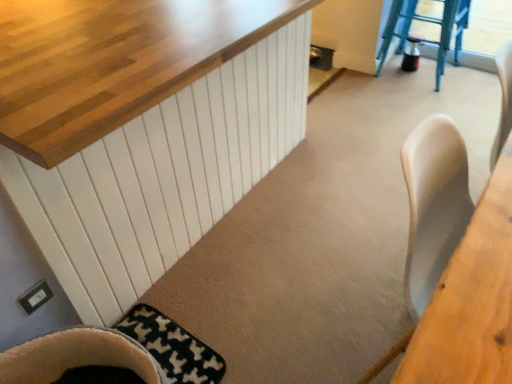
Question: Does wooden table at right have a smaller size compared to soft beige fabric chair at lower left?

Choices:
 (A) no
 (B) yes

Answer: (A)

Question: From the image's perspective, is wooden table at right beneath soft beige fabric chair at lower left?

Choices:
 (A) no
 (B) yes

Answer: (A)

Question: Considering the relative sizes of wooden table at right and soft beige fabric chair at lower left in the image provided, is wooden table at right shorter than soft beige fabric chair at lower left?

Choices:
 (A) no
 (B) yes

Answer: (A)

Question: Is wooden table at right thinner than soft beige fabric chair at lower left?

Choices:
 (A) no
 (B) yes

Answer: (A)

Question: From a real-world perspective, is wooden table at right located beneath soft beige fabric chair at lower left?

Choices:
 (A) yes
 (B) no

Answer: (B)

Question: Does wooden table at right turn towards soft beige fabric chair at lower left?

Choices:
 (A) no
 (B) yes

Answer: (A)

Question: From a real-world perspective, is black and white textured mat at lower left physically below wooden table at right?

Choices:
 (A) yes
 (B) no

Answer: (A)

Question: From the image's perspective, is black and white textured mat at lower left over wooden table at right?

Choices:
 (A) yes
 (B) no

Answer: (B)

Question: Is black and white textured mat at lower left not inside wooden table at right?

Choices:
 (A) yes
 (B) no

Answer: (A)

Question: Considering the relative sizes of black and white textured mat at lower left and wooden table at right in the image provided, is black and white textured mat at lower left thinner than wooden table at right?

Choices:
 (A) no
 (B) yes

Answer: (A)

Question: Does black and white textured mat at lower left come in front of wooden table at right?

Choices:
 (A) yes
 (B) no

Answer: (B)

Question: Are black and white textured mat at lower left and wooden table at right making contact?

Choices:
 (A) no
 (B) yes

Answer: (A)

Question: Considering the relative positions of wooden table at right and black and white textured mat at lower left in the image provided, is wooden table at right to the left of black and white textured mat at lower left from the viewer's perspective?

Choices:
 (A) yes
 (B) no

Answer: (B)